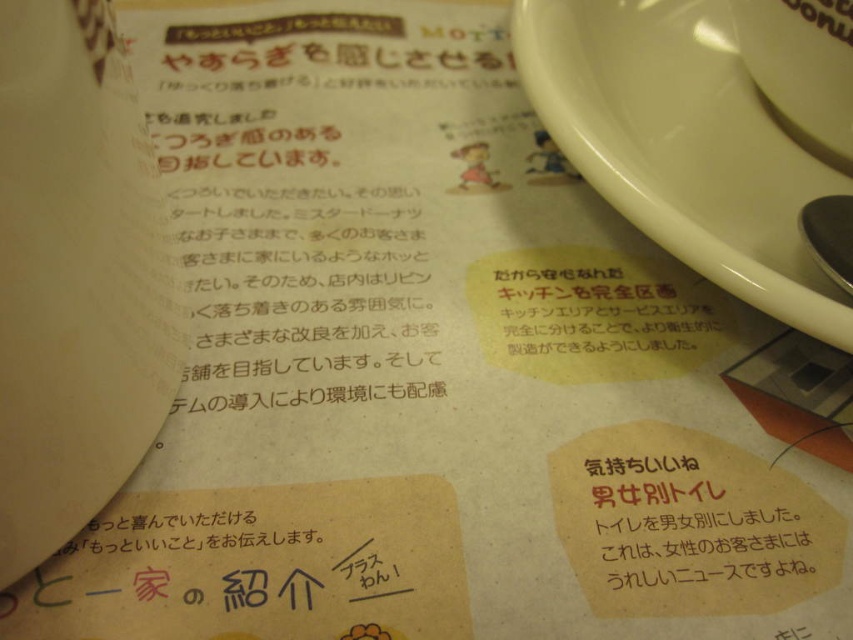
Is white glossy coffee cup at upper right closer to the viewer compared to shiny metallic spoon at right?

No, white glossy coffee cup at upper right is further to the viewer.

Is point (819, 45) positioned before point (813, 218)?

No, (819, 45) is further to viewer.

Find the location of `white glossy coffee cup at upper right`. white glossy coffee cup at upper right is located at coordinates (802, 68).

Can you confirm if white glossy saucer at upper right is positioned below shiny metallic spoon at right?

Actually, white glossy saucer at upper right is above shiny metallic spoon at right.

Can you confirm if white glossy saucer at upper right is thinner than shiny metallic spoon at right?

No.

Measure the distance between white glossy saucer at upper right and camera.

white glossy saucer at upper right is 24.57 inches from camera.

Find the location of a particular element. white glossy saucer at upper right is located at coordinates (683, 145).

The image size is (853, 640). What do you see at coordinates (683, 145) in the screenshot?
I see `white glossy saucer at upper right` at bounding box center [683, 145].

Is white glossy saucer at upper right smaller than white glossy coffee cup at upper right?

Incorrect, white glossy saucer at upper right is not smaller in size than white glossy coffee cup at upper right.

Between point (676, 118) and point (772, 38), which one is positioned in front?

Point (772, 38) is more forward.

This screenshot has height=640, width=853. Find the location of `white glossy saucer at upper right`. white glossy saucer at upper right is located at coordinates (683, 145).